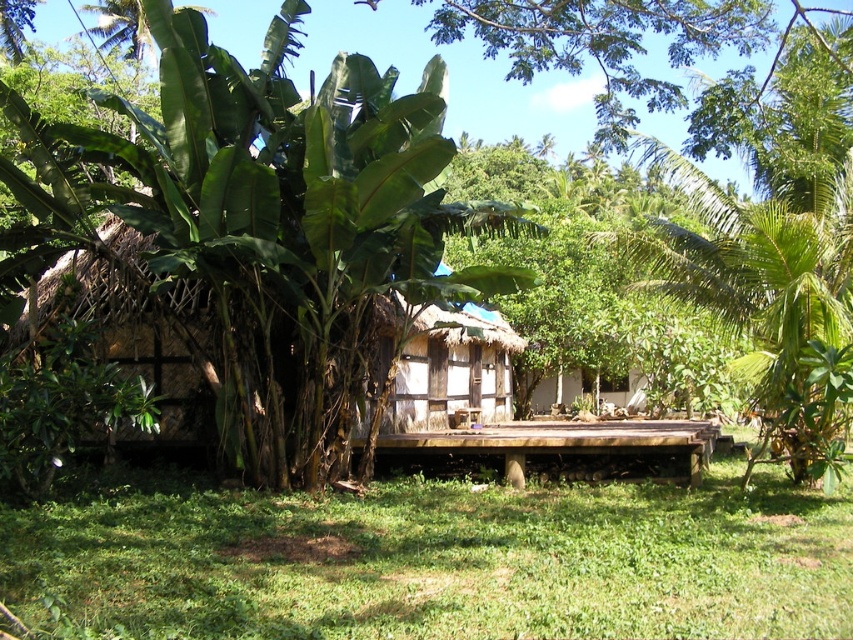
Which is in front, point (772, 608) or point (0, 104)?

Positioned in front is point (772, 608).

Does point (811, 552) come behind point (190, 253)?

No.

I want to click on green grass at center, so click(438, 561).